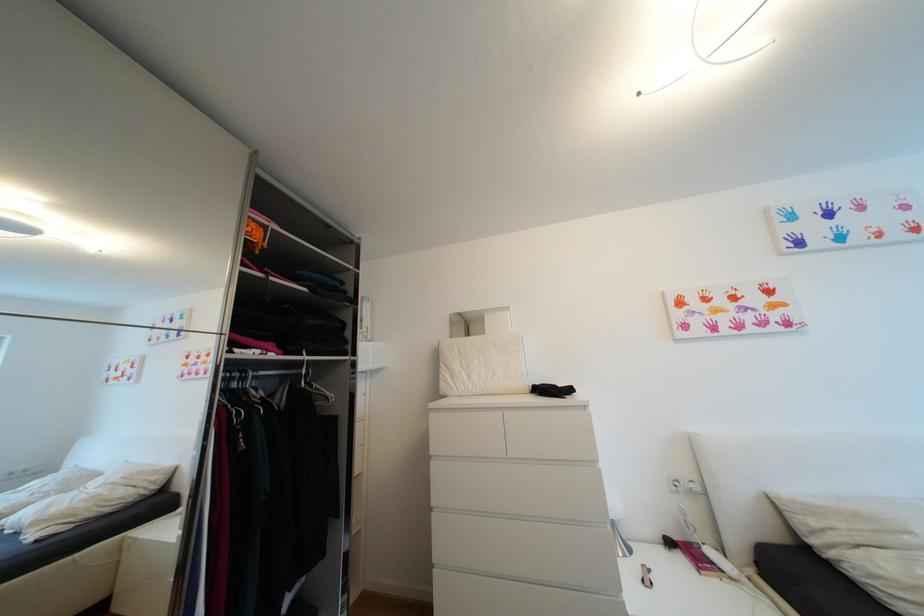
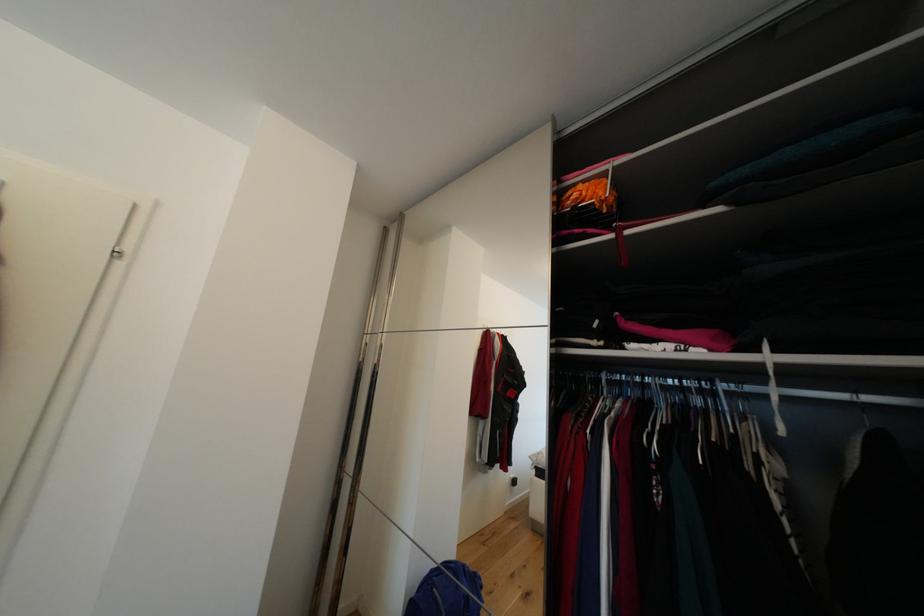
Based on the continuous images, in which direction is the camera rotating?

The rotation direction of the camera is left-up.